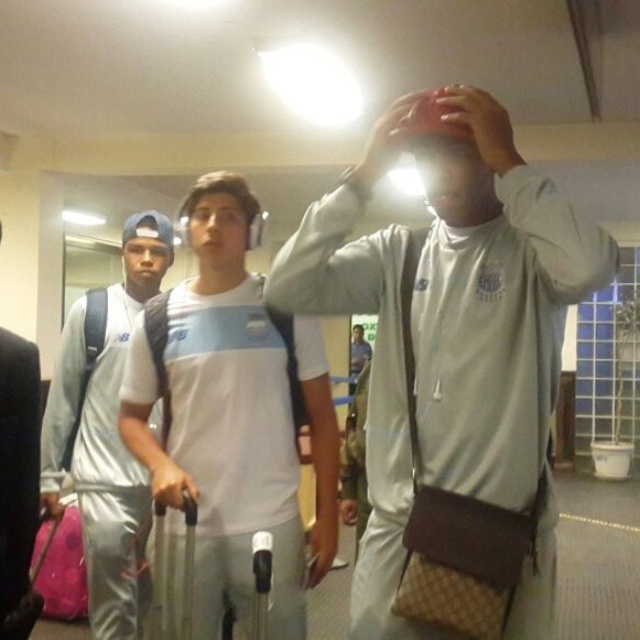
Is white matte jacket at center behind matte skin hand at upper center?

No, it is in front of matte skin hand at upper center.

The image size is (640, 640). Describe the element at coordinates (493, 320) in the screenshot. I see `white matte jacket at center` at that location.

Identify the location of white matte jacket at center. The width and height of the screenshot is (640, 640). (493, 320).

Who is lower down, silver metallic tracksuit at left or white matte jersey at center?

white matte jersey at center is below.

Between silver metallic tracksuit at left and white matte jersey at center, which one has less height?

white matte jersey at center is shorter.

Who is more forward, [102,452] or [356,332]?

Positioned in front is point [102,452].

Where is `silver metallic tracksuit at left`? The image size is (640, 640). silver metallic tracksuit at left is located at coordinates (106, 433).

Can you confirm if white matte t-shirt at center is smaller than matte skin hand at upper center?

No.

Does white matte t-shirt at center have a greater height compared to matte skin hand at upper center?

Indeed, white matte t-shirt at center has a greater height compared to matte skin hand at upper center.

What do you see at coordinates (236, 413) in the screenshot?
I see `white matte t-shirt at center` at bounding box center [236, 413].

This screenshot has height=640, width=640. In order to click on white matte t-shirt at center in this screenshot , I will do `click(236, 413)`.